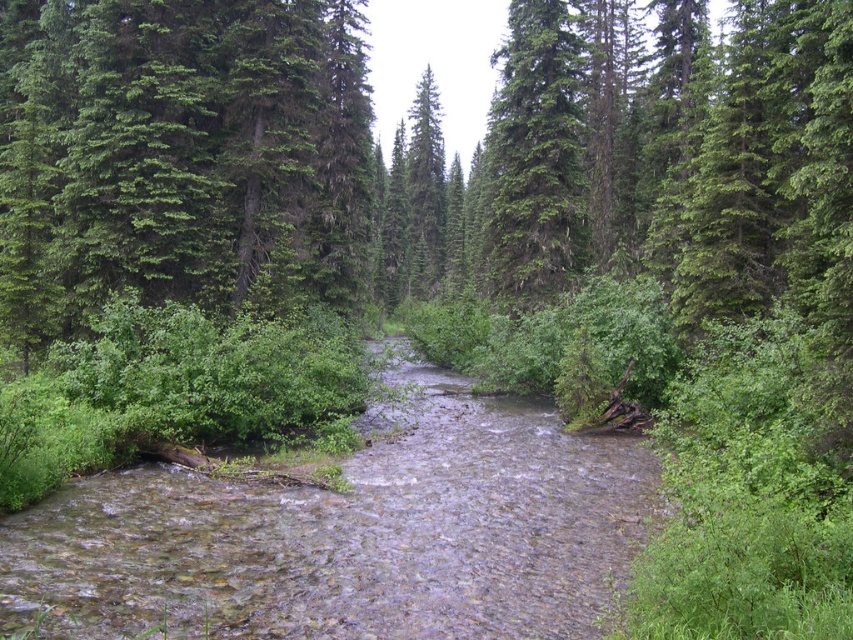
Who is shorter, clear water stream at center or green textured tree at upper center?

Standing shorter between the two is clear water stream at center.

Locate an element on the screen. The width and height of the screenshot is (853, 640). clear water stream at center is located at coordinates (350, 532).